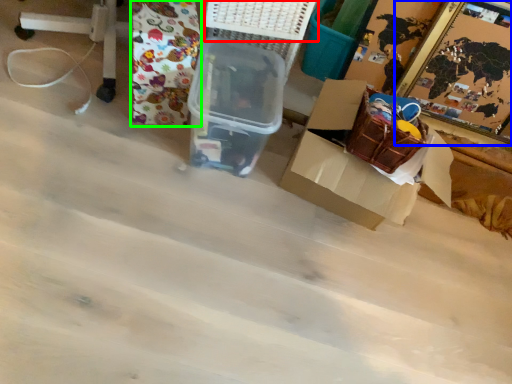
Question: Which object is positioned closest to basket (highlighted by a red box)? Select from picture frame (highlighted by a blue box) and wrapping paper (highlighted by a green box).

Choices:
 (A) picture frame
 (B) wrapping paper

Answer: (B)